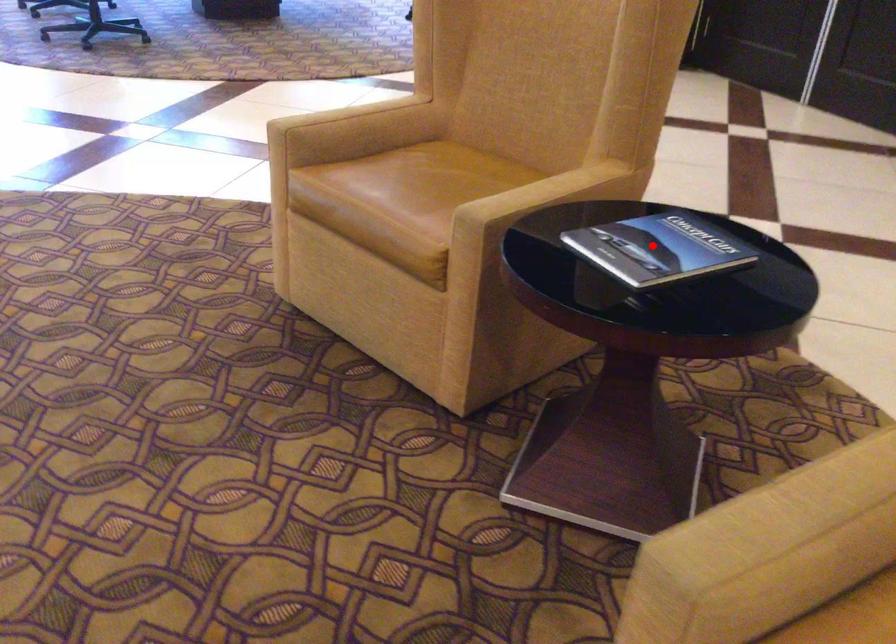
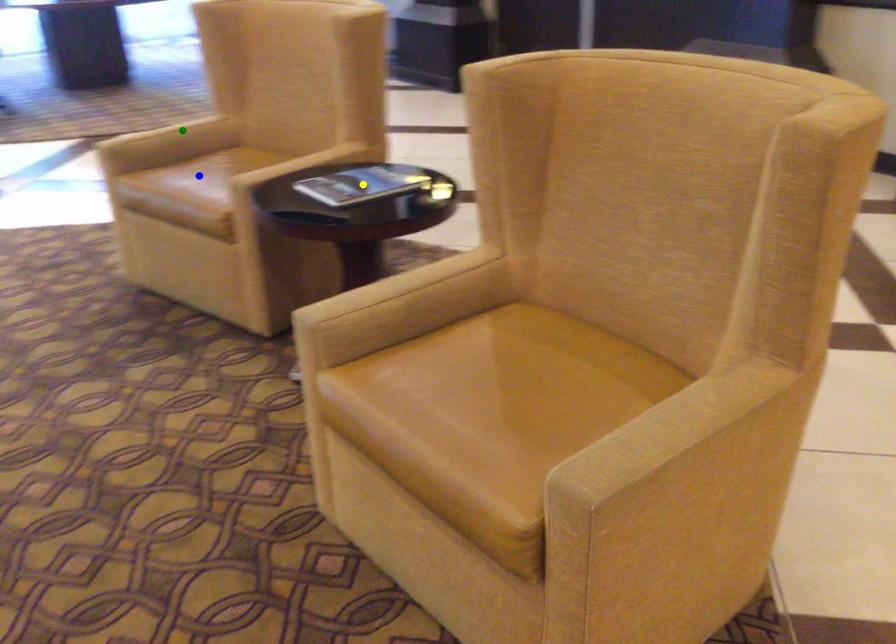
Question: I am providing you with two images of the same scene from different viewpoints. A red point is marked on the first image. You are given multiple points on the second image. Which spot in image 2 lines up with the point in image 1?

Choices:
 (A) green point
 (B) yellow point
 (C) blue point

Answer: (B)